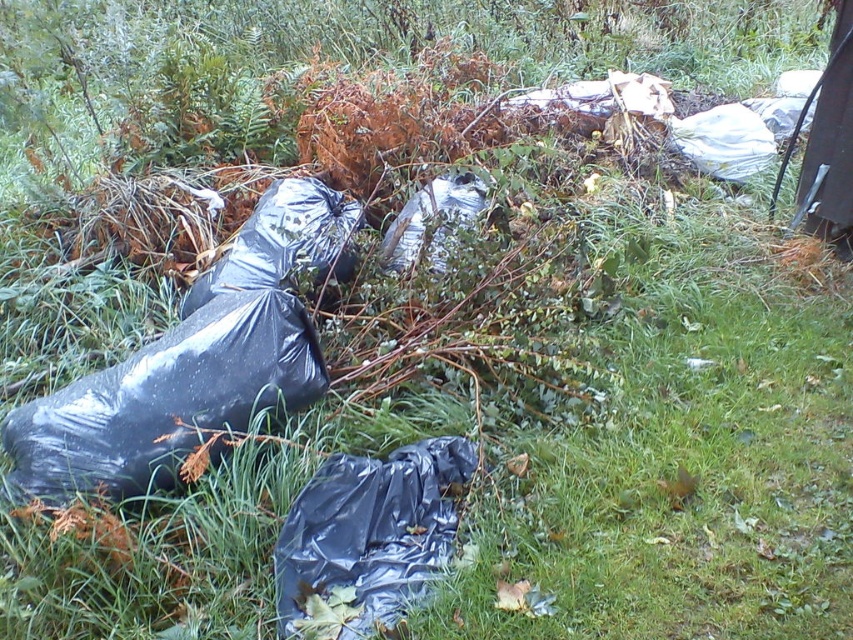
You are a park ranger trying to clean up the area. You have a GPS device that shows a point at coordinates (165,400). What object is located at that point?

The point at coordinates (165,400) marks the location of the black plastic bag at left.

You are a park maintenance worker who needs to collect the black plastic bag at left and the black plastic bag at lower center. Which bag should you pick up first if you want to start with the one closest to you?

You should pick up the black plastic bag at left first because it is closer to you than the black plastic bag at lower center.

You are a park ranger trying to organize the litter in the grassy area. You see the black plastic bag at left and the black plastic bag at lower center. Which bag should you pick up first if you want to collect the wider one?

The black plastic bag at left might be wider than the black plastic bag at lower center, so you should pick up the black plastic bag at left first.